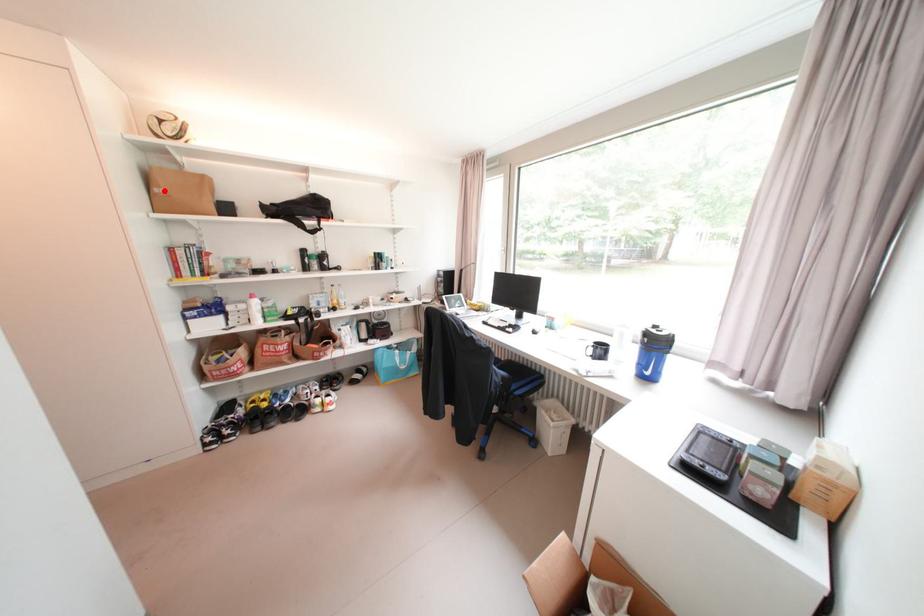
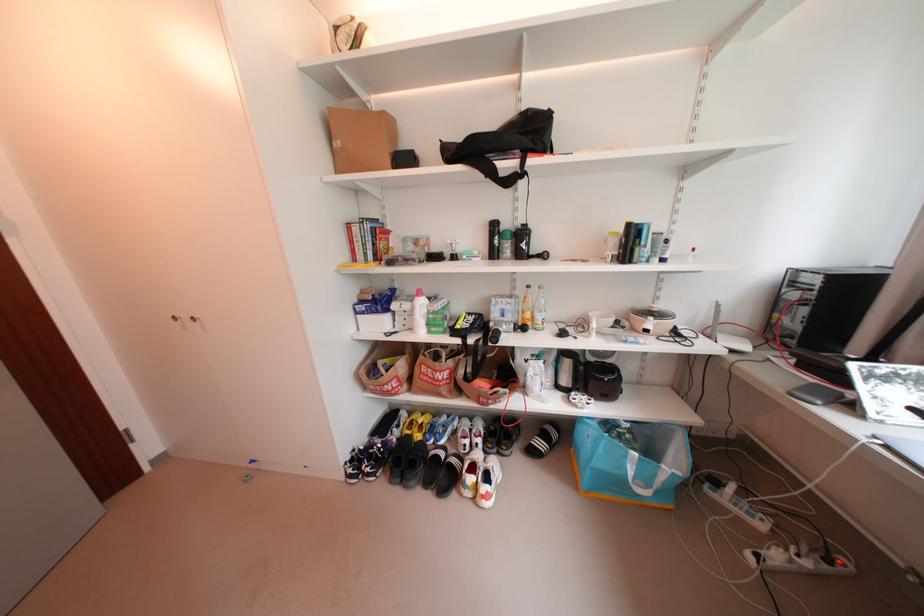
Question: I am providing you with two images of the same scene from different viewpoints. Image1 has a red point marked. In image2, the corresponding 3D location appears at what relative position? Reply with the corresponding letter.

Choices:
 (A) Closer
 (B) Farther

Answer: (A)